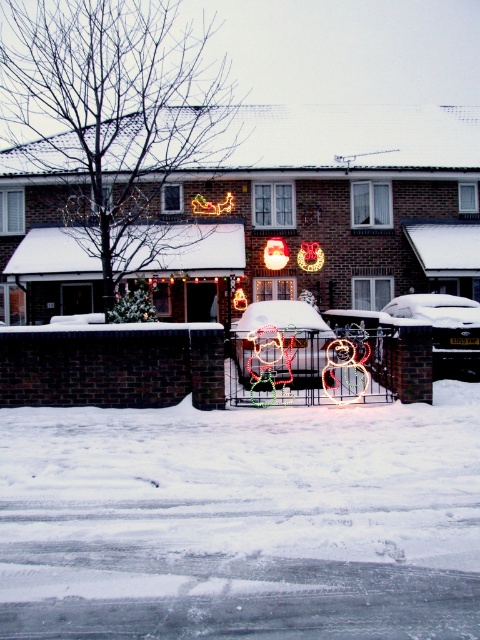
You are a delivery person trying to park your van on the residential street. The van requires a space that is at least as wide as the neon santa at center. Can you park your van in the area where the white fluffy snow at lower center is located?

The white fluffy snow at lower center is smaller than the neon santa at center. Since the van needs a space at least as wide as the neon santa at center, the area with the white fluffy snow at lower center is too narrow, so the van cannot park there.

Looking at this image, you are standing at the edge of the residential street scene. There is a point marked at coordinates point (x=241, y=522). What is located at that point?

The point (x=241, y=522) corresponds to the white fluffy snow at lower center.